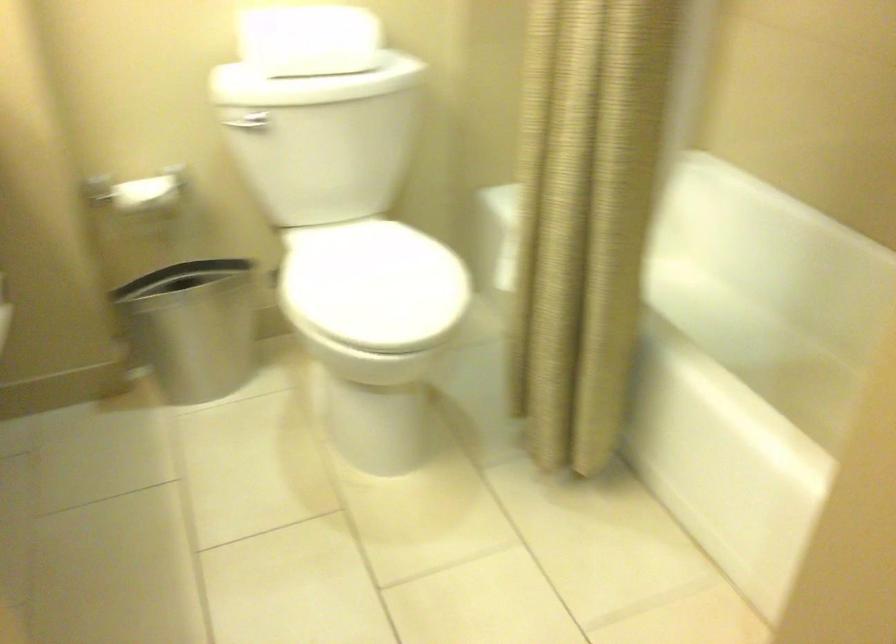
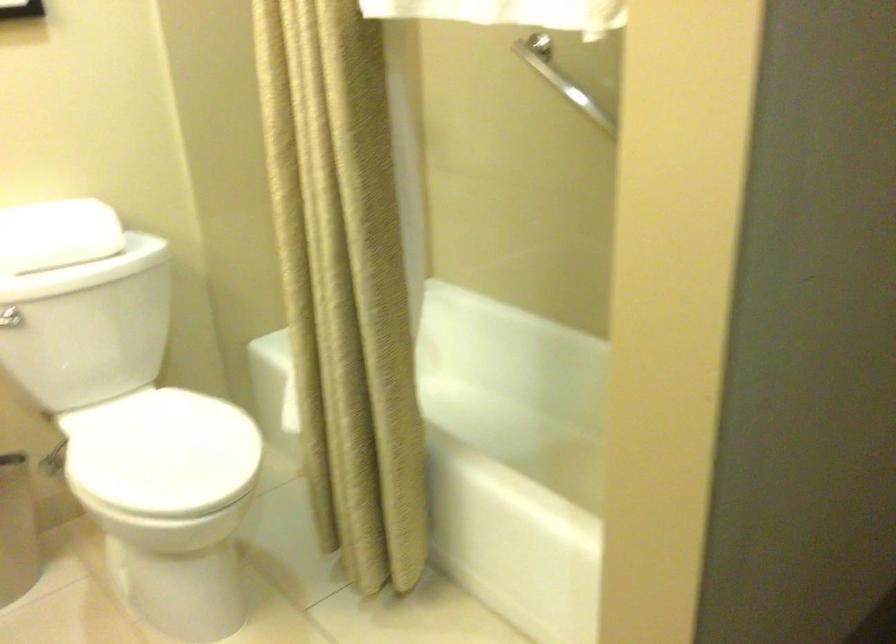
Find the pixel in the second image that matches (369,283) in the first image.

(161, 453)